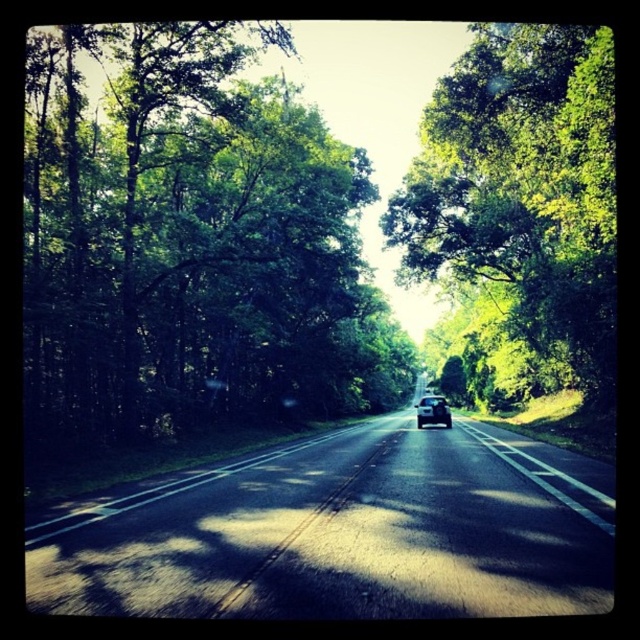
Looking at this image, you are driving a car and see the black asphalt road at center and the shiny black car at center ahead. Which object is closer to you?

The shiny black car at center is closer to you because the black asphalt road at center is in front of it, meaning the road is behind the car.

You are driving a car and see the shiny black car at center ahead on the road. There is also a green leafy tree at left nearby. From your perspective, which object is positioned more to the left?

The green leafy tree at left is positioned more to the left compared to the shiny black car at center.